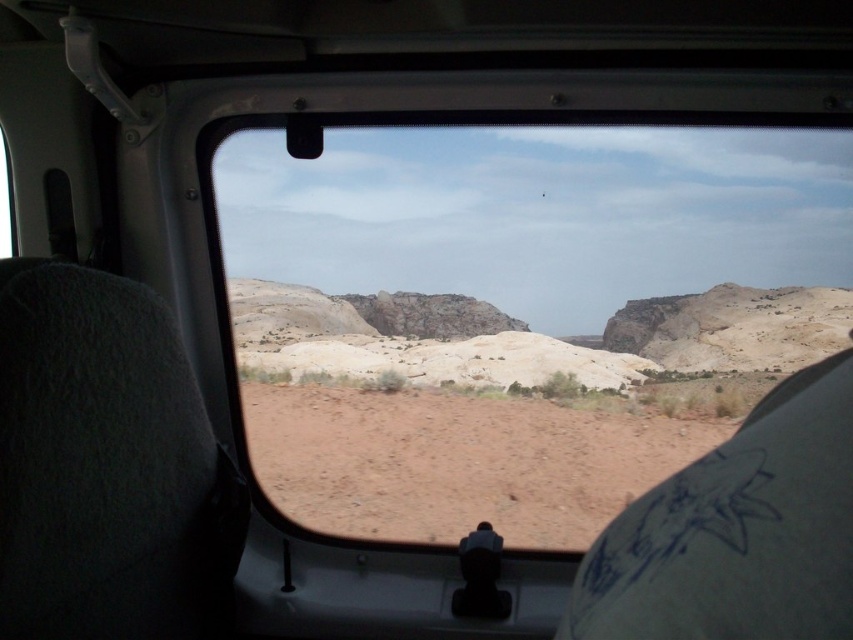
Does transparent glass window at center have a larger size compared to brown sandy dirt at center?

Indeed, transparent glass window at center has a larger size compared to brown sandy dirt at center.

Can you confirm if transparent glass window at center is wider than brown sandy dirt at center?

Yes.

Does point (672, 417) come behind point (436, 529)?

That is True.

The image size is (853, 640). What are the coordinates of `transparent glass window at center` in the screenshot? It's located at (518, 314).